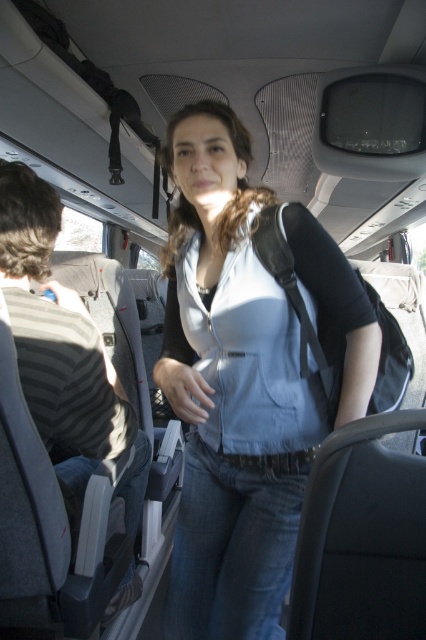
You are a passenger on the bus and want to know if the matte blue jacket at center is shorter than the striped fabric shirt at left. Can you confirm this?

The matte blue jacket at center has a lesser height compared to striped fabric shirt at left, so yes, the matte blue jacket at center is shorter than the striped fabric shirt at left.